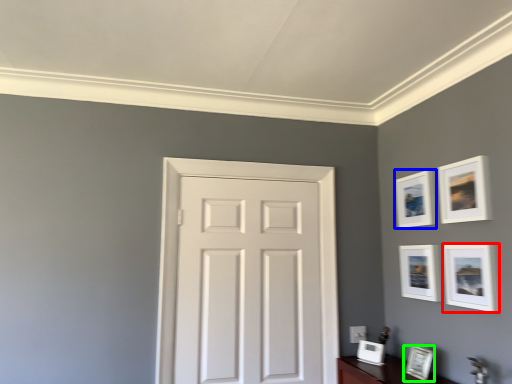
Question: Which object is the farthest from picture frame (highlighted by a red box)? Choose among these: picture frame (highlighted by a blue box) or picture frame (highlighted by a green box).

Choices:
 (A) picture frame
 (B) picture frame

Answer: (B)